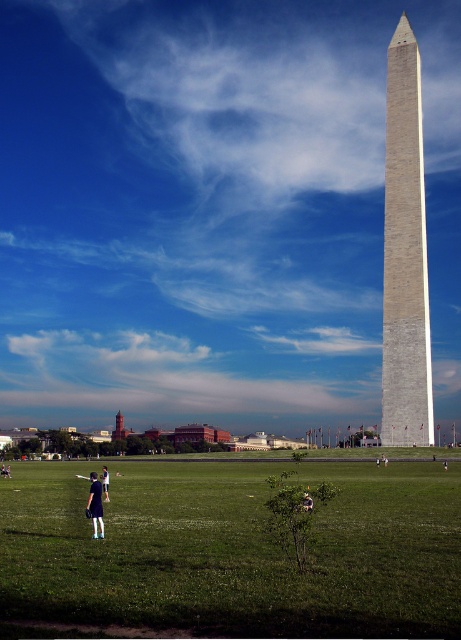
Question: Considering the real-world distances, which object is closest to the denim jacket at lower right?

Choices:
 (A) blue denim jeans at lower left
 (B) green grass at lower center

Answer: (A)

Question: Does green grass at lower center appear over gray stone obelisk at center?

Choices:
 (A) yes
 (B) no

Answer: (B)

Question: Which of the following is the closest to the observer?

Choices:
 (A) denim jacket at lower right
 (B) gray stone obelisk at center
 (C) blue denim jeans at lower left

Answer: (A)

Question: Is green grass at lower center above gray stone obelisk at center?

Choices:
 (A) no
 (B) yes

Answer: (A)

Question: Which of these objects is positioned farthest from the green grass at lower center?

Choices:
 (A) dark blue dress at lower left
 (B) blue denim jeans at lower left

Answer: (A)

Question: Observing the image, what is the correct spatial positioning of green grass at lower center in reference to gray stone obelisk at center?

Choices:
 (A) below
 (B) above

Answer: (A)